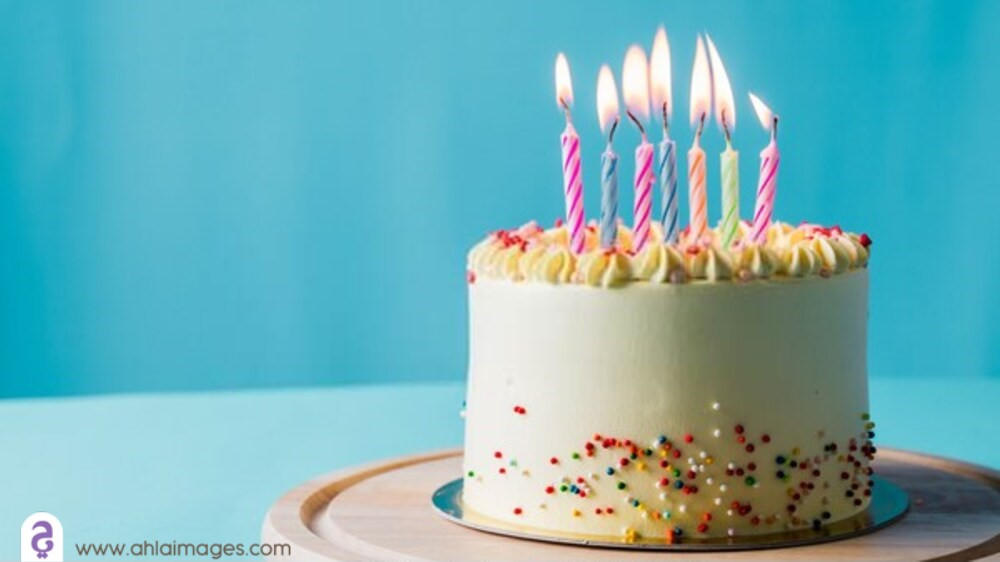
Locate an element on the screen. This screenshot has width=1000, height=562. candle flames is located at coordinates (561, 78), (601, 96), (634, 67), (658, 57), (703, 89), (720, 84), (760, 105).